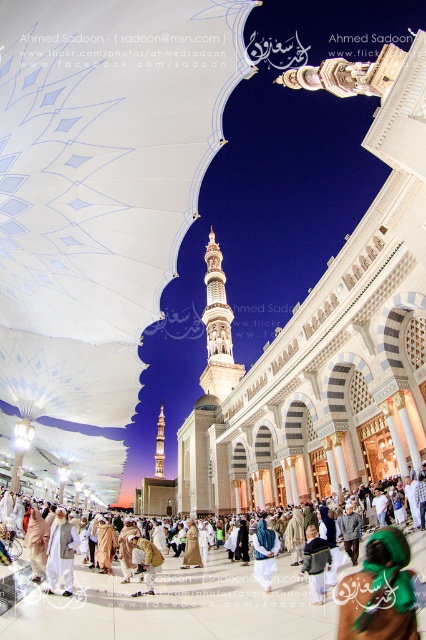
You are a visitor at the mosque and want to take a photo of both the white fabric canopy at center and the golden fabric robe at center. Which object should you position to the left side in your camera frame to capture both correctly?

To capture both the white fabric canopy at center and the golden fabric robe at center correctly, you should position the white fabric canopy at center to the left side of the golden fabric robe at center in your camera frame since the white fabric canopy at center is already on the left side of the golden fabric robe at center in the scene.

You are standing at the entrance of the mosque and see a white fabric person at center and a brown fabric at center. You want to greet both of them. Which one is closer to you?

The white fabric person at center is 8.83 meters away from brown fabric at center. Therefore, the brown fabric at center is closer to you since it is only 8.83 meters away from the white fabric person at center, who is farther away.

You are a photographer at the mosque during twilight. You see a white fabric person at center and a brown fabric at center. Which one is more to the left?

The white fabric person at center is more to the left side of brown fabric at center.